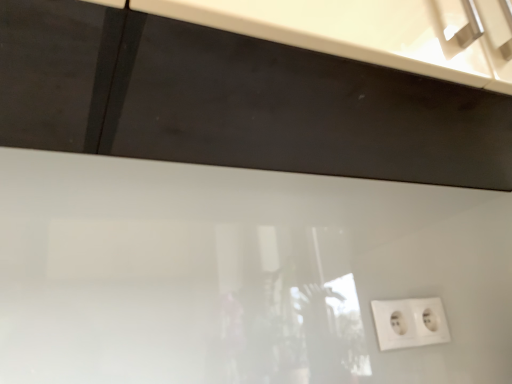
Question: Is white glossy cabinet at upper center a part of white plastic power plugs and sockets at lower right?

Choices:
 (A) no
 (B) yes

Answer: (A)

Question: Does white plastic power plugs and sockets at lower right appear on the right side of white glossy cabinet at upper center?

Choices:
 (A) yes
 (B) no

Answer: (A)

Question: From the image's perspective, is white plastic power plugs and sockets at lower right under white glossy cabinet at upper center?

Choices:
 (A) yes
 (B) no

Answer: (A)

Question: Is white plastic power plugs and sockets at lower right turned away from white glossy cabinet at upper center?

Choices:
 (A) no
 (B) yes

Answer: (A)

Question: From a real-world perspective, is white plastic power plugs and sockets at lower right over white glossy cabinet at upper center?

Choices:
 (A) yes
 (B) no

Answer: (B)

Question: Is white plastic power plugs and sockets at lower right shorter than white glossy cabinet at upper center?

Choices:
 (A) yes
 (B) no

Answer: (A)

Question: From the image's perspective, does white glossy cabinet at upper center appear lower than white plastic power plugs and sockets at lower right?

Choices:
 (A) no
 (B) yes

Answer: (A)

Question: Considering the relative sizes of white glossy cabinet at upper center and white plastic power plugs and sockets at lower right in the image provided, is white glossy cabinet at upper center thinner than white plastic power plugs and sockets at lower right?

Choices:
 (A) yes
 (B) no

Answer: (B)

Question: Does white glossy cabinet at upper center lie behind white plastic power plugs and sockets at lower right?

Choices:
 (A) no
 (B) yes

Answer: (A)

Question: Is white glossy cabinet at upper center directly adjacent to white plastic power plugs and sockets at lower right?

Choices:
 (A) yes
 (B) no

Answer: (B)

Question: Can you confirm if white glossy cabinet at upper center is wider than white plastic power plugs and sockets at lower right?

Choices:
 (A) yes
 (B) no

Answer: (A)

Question: From a real-world perspective, is white glossy cabinet at upper center over white plastic power plugs and sockets at lower right?

Choices:
 (A) no
 (B) yes

Answer: (B)

Question: Is point (394, 322) positioned closer to the camera than point (206, 62)?

Choices:
 (A) farther
 (B) closer

Answer: (A)